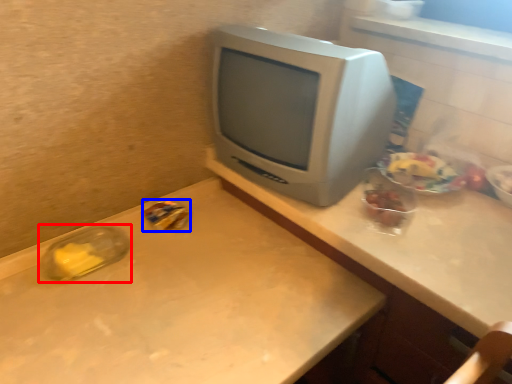
Question: Which of the following is the closest to the observer, glass jar (highlighted by a red box) or food (highlighted by a blue box)?

Choices:
 (A) glass jar
 (B) food

Answer: (A)